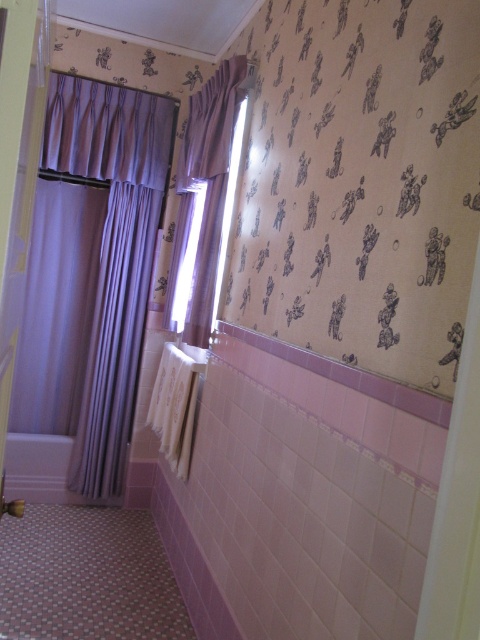
You are designing a bathroom layout and need to ensure that the purple fabric shower curtain at left and the purple fabric curtain at upper center are proportionate. Based on their heights, which one should be placed higher up to maintain visual balance?

The purple fabric shower curtain at left is taller than the purple fabric curtain at upper center, so placing the taller shower curtain lower and the shorter curtain higher will create a balanced visual arrangement.

You are a guest in this bathroom and want to know which purple curtain is closer to you. Can you determine which one is closer between the purple fabric shower curtain at left and the purple fabric curtain at upper center?

The purple fabric shower curtain at left is closer to you because the purple fabric curtain at upper center is positioned behind it.